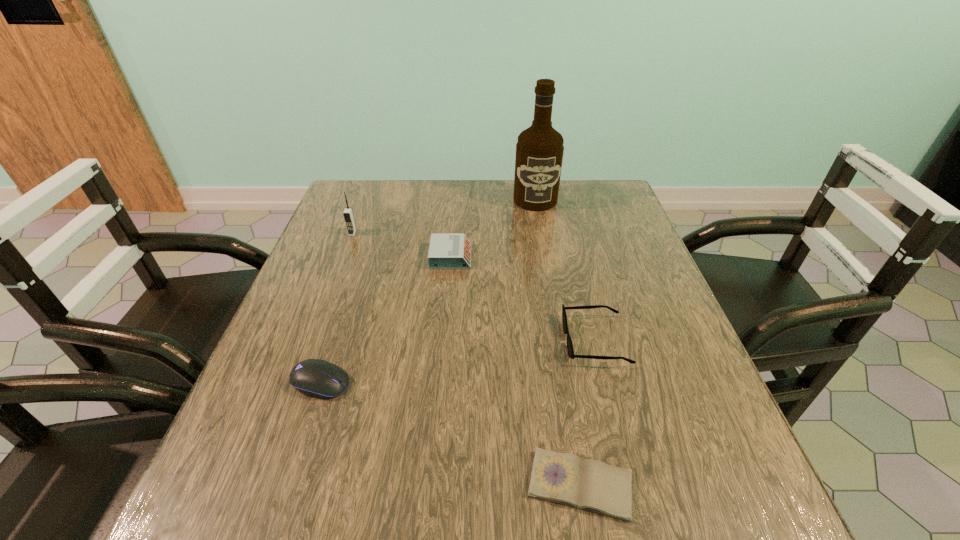
This screenshot has height=540, width=960. Identify the location of free region located on the label of the farthest object. (549, 275).

Locate an element on the screen. This screenshot has height=540, width=960. vacant space situated on the front-facing side of the cellular telephone is located at coordinates (307, 355).

This screenshot has height=540, width=960. Identify the location of vacant space located on the back of the third farthest object. (455, 197).

Identify the location of free space located on the front-facing side of the sunglasses. (540, 340).

Locate an element on the screen. vacant space located on the front-facing side of the sunglasses is located at coordinates (536, 340).

Find the location of a particular element. The image size is (960, 540). free location located 0.130m on the front-facing side of the sunglasses is located at coordinates (502, 340).

The width and height of the screenshot is (960, 540). Identify the location of free spot located 0.160m on the right of the computer mouse. (437, 382).

Where is `vacant position located on the left of the shortest object`? vacant position located on the left of the shortest object is located at coordinates (332, 485).

Identify the location of object that is at the far edge. The height and width of the screenshot is (540, 960). (539, 151).

You are a GUI agent. You are given a task and a screenshot of the screen. Output one action in this format:
    pyautogui.click(x=<x>, y=<y>)
    Task: Click on the object situated at the near edge
    
    Given the screenshot: What is the action you would take?
    pyautogui.click(x=563, y=478)